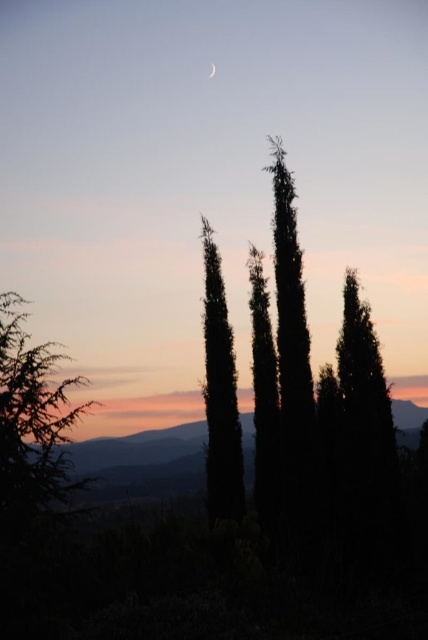
You are an artist trying to paint this sunset scene. You notice the green leafy tree at left and the silvery reflective crescent at upper center. Which object should you make wider in your painting to stay true to the actual scene?

You should make the green leafy tree at left wider in your painting because its width surpasses that of the silvery reflective crescent at upper center.

You are an astronomer observing the sunset scene. You notice the green leafy tree at left and the silvery reflective crescent at upper center. Which object appears taller in the image?

The green leafy tree at left appears taller than the silvery reflective crescent at upper center in the image.

You are an astronomer observing the sunset scene. You notice the silhouette coniferous tree at center and the silvery reflective crescent at upper center. Which object occupies a larger horizontal space in the image?

The silhouette coniferous tree at center has a greater width than the silvery reflective crescent at upper center, so it occupies a larger horizontal space in the image.